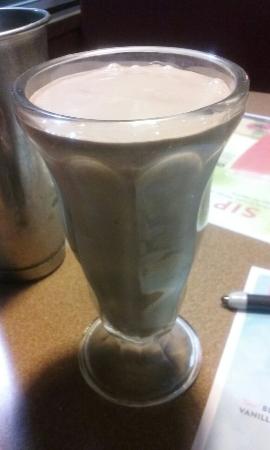
Image resolution: width=270 pixels, height=450 pixels. I want to click on 2 papers, so [x=258, y=388], [x=257, y=206].